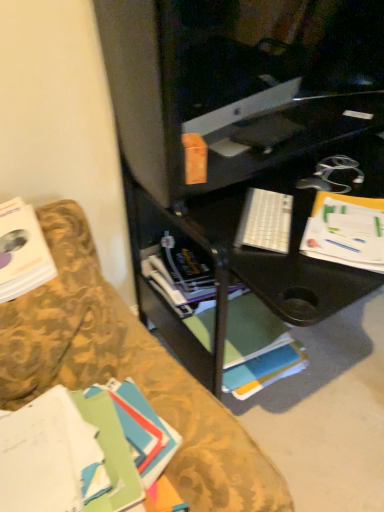
Question: Would you consider white paper book at left, marked as the 2th book in a back-to-front arrangement, to be distant from white paper at right?

Choices:
 (A) no
 (B) yes

Answer: (A)

Question: From a real-world perspective, is white paper book at left, marked as the 2th book in a back-to-front arrangement, under white paper at right?

Choices:
 (A) no
 (B) yes

Answer: (A)

Question: Does white paper book at left, marked as the 2th book in a back-to-front arrangement, appear on the left side of white paper at right?

Choices:
 (A) yes
 (B) no

Answer: (A)

Question: From a real-world perspective, is white paper book at left, placed as the 2th book when sorted from front to back, on top of white paper at right?

Choices:
 (A) no
 (B) yes

Answer: (B)

Question: From the image's perspective, would you say white paper book at left, placed as the 2th book when sorted from front to back, is shown under white paper at right?

Choices:
 (A) yes
 (B) no

Answer: (A)

Question: Considering the positions of white matte book at center, which is the first book in back-to-front order, and white paper at right in the image, is white matte book at center, which is the first book in back-to-front order, bigger or smaller than white paper at right?

Choices:
 (A) big
 (B) small

Answer: (A)

Question: From the image's perspective, is white matte book at center, which is the first book in back-to-front order, positioned above or below white paper at right?

Choices:
 (A) below
 (B) above

Answer: (A)

Question: From a real-world perspective, relative to white paper at right, is white matte book at center, which is the first book in back-to-front order, vertically above or below?

Choices:
 (A) below
 (B) above

Answer: (A)

Question: In terms of height, does white matte book at center, which is the first book in back-to-front order, look taller or shorter compared to white paper at right?

Choices:
 (A) tall
 (B) short

Answer: (A)

Question: Considering the relative positions of white matte book at center, the 3th book positioned from the front, and white paper book at left, placed as the 2th book when sorted from front to back, in the image provided, is white matte book at center, the 3th book positioned from the front, to the left or to the right of white paper book at left, placed as the 2th book when sorted from front to back,?

Choices:
 (A) left
 (B) right

Answer: (B)

Question: Is point (233, 287) positioned closer to the camera than point (31, 210)?

Choices:
 (A) farther
 (B) closer

Answer: (A)

Question: From the image's perspective, relative to white paper book at left, marked as the 2th book in a back-to-front arrangement, is white matte book at center, which is the first book in back-to-front order, above or below?

Choices:
 (A) above
 (B) below

Answer: (B)

Question: Considering their positions, is white matte book at center, the 3th book positioned from the front, located in front of or behind white paper book at left, marked as the 2th book in a back-to-front arrangement?

Choices:
 (A) front
 (B) behind

Answer: (B)

Question: Is green matte book at lower left, marked as the third book in a back-to-front arrangement, wider or thinner than white plastic keyboard at center?

Choices:
 (A) thin
 (B) wide

Answer: (B)

Question: In the image, is green matte book at lower left, placed as the 1th book when sorted from front to back, positioned in front of or behind white plastic keyboard at center?

Choices:
 (A) behind
 (B) front

Answer: (B)